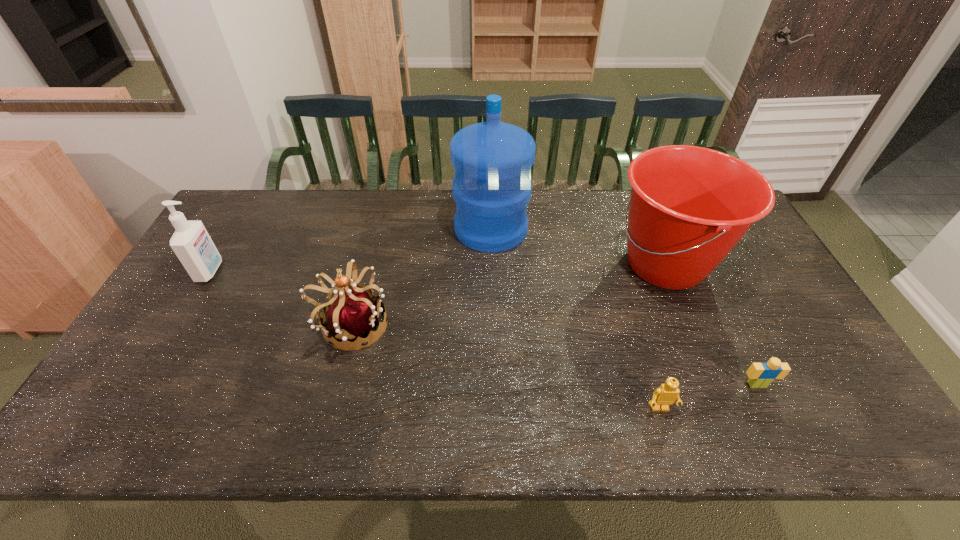
I want to click on empty location between the leftmost object and the second tallest object, so click(438, 268).

In order to click on free spot between the third shortest object and the bucket in this screenshot , I will do `click(509, 294)`.

Image resolution: width=960 pixels, height=540 pixels. I want to click on free space between the left Lego and the fifth farthest object, so click(708, 396).

This screenshot has height=540, width=960. In order to click on vacant space that is in between the third object from left to right and the third shortest object in this screenshot , I will do `click(421, 276)`.

Locate an element on the screen. The width and height of the screenshot is (960, 540). free point between the third shortest object and the fifth shortest object is located at coordinates (509, 294).

Locate an element on the screen. The image size is (960, 540). empty space that is in between the bucket and the fifth farthest object is located at coordinates (711, 325).

You are a GUI agent. You are given a task and a screenshot of the screen. Output one action in this format:
    pyautogui.click(x=<x>, y=<y>)
    Task: Click on the blank region between the second tallest object and the fourth tallest object
    
    Given the screenshot: What is the action you would take?
    pyautogui.click(x=509, y=294)

I want to click on vacant space that's between the leftmost object and the bucket, so click(438, 268).

You are a GUI agent. You are given a task and a screenshot of the screen. Output one action in this format:
    pyautogui.click(x=<x>, y=<y>)
    Task: Click on the vacant space that is in between the left Lego and the bucket
    This screenshot has height=540, width=960.
    Given the screenshot: What is the action you would take?
    pyautogui.click(x=662, y=336)

Locate an element on the screen. The image size is (960, 540). the fifth closest object to the fifth farthest object is located at coordinates (191, 242).